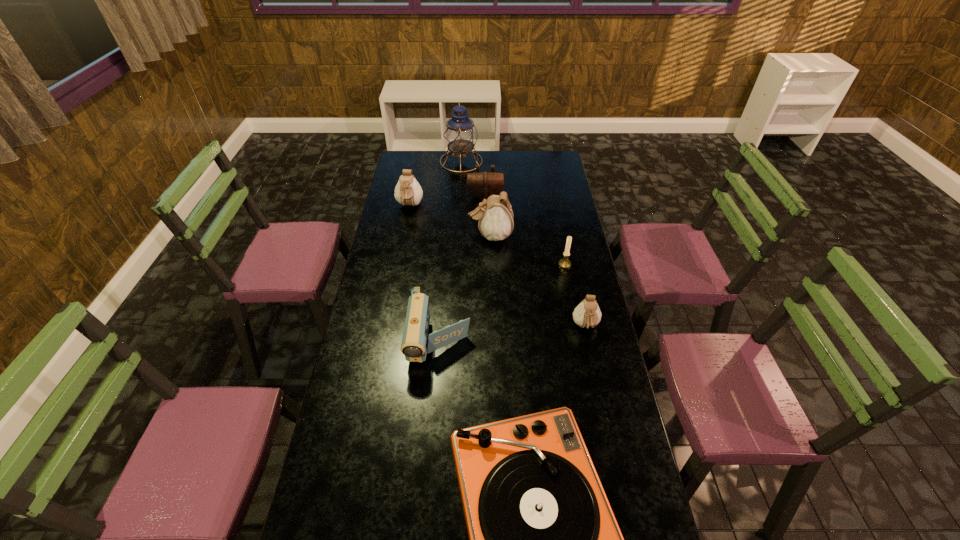
The width and height of the screenshot is (960, 540). In order to click on blue lantern in this screenshot , I will do `click(460, 134)`.

In order to click on the tallest object in this screenshot , I will do `click(460, 134)`.

Find the location of a particular element. The height and width of the screenshot is (540, 960). the biggest white pouch is located at coordinates (496, 221).

The height and width of the screenshot is (540, 960). Identify the location of the fifth nearest object. (496, 221).

The width and height of the screenshot is (960, 540). I want to click on the leftmost object, so click(408, 192).

Where is `the leftmost pouch`? Image resolution: width=960 pixels, height=540 pixels. the leftmost pouch is located at coordinates (408, 192).

You are a GUI agent. You are given a task and a screenshot of the screen. Output one action in this format:
    pyautogui.click(x=<x>, y=<y>)
    Task: Click on the brown pouch
    The image size is (960, 540).
    Given the screenshot: What is the action you would take?
    pyautogui.click(x=482, y=185)

At what (x,y) coordinates should I click in order to perform the action: click on candle holder. Please return your answer as a coordinate pair (x, y). Looking at the image, I should click on (564, 263).

Where is `camcorder`? camcorder is located at coordinates (414, 346).

Identify the location of the nearest pouch. The height and width of the screenshot is (540, 960). (587, 314).